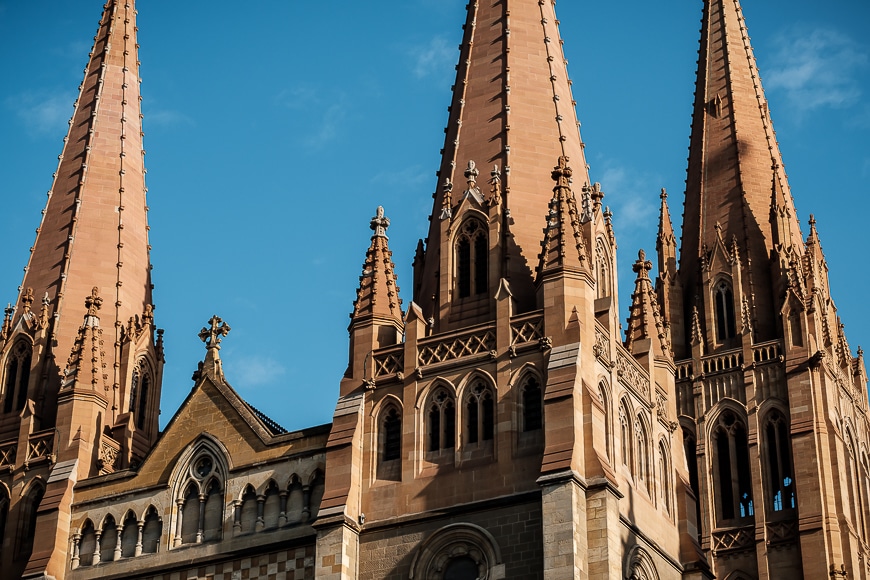
Find the location of a particular element. Image resolution: width=870 pixels, height=580 pixels. design in wall is located at coordinates (730, 416), (479, 384).